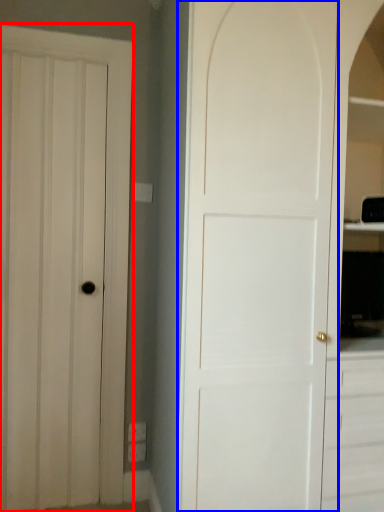
Question: Among these objects, which one is nearest to the camera, door (highlighted by a red box) or door (highlighted by a blue box)?

Choices:
 (A) door
 (B) door

Answer: (B)